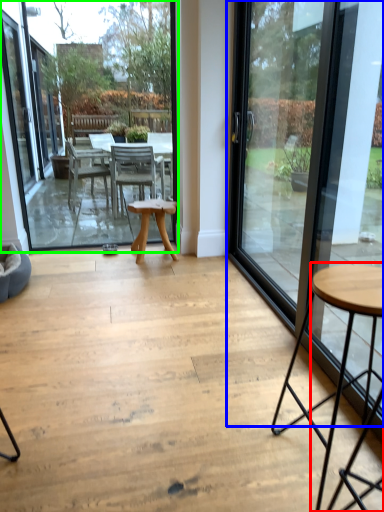
Question: Estimate the real-world distances between objects in this image. Which object is closer to coffee table (highlighted by a red box), door (highlighted by a blue box) or window screen (highlighted by a green box)?

Choices:
 (A) door
 (B) window screen

Answer: (A)